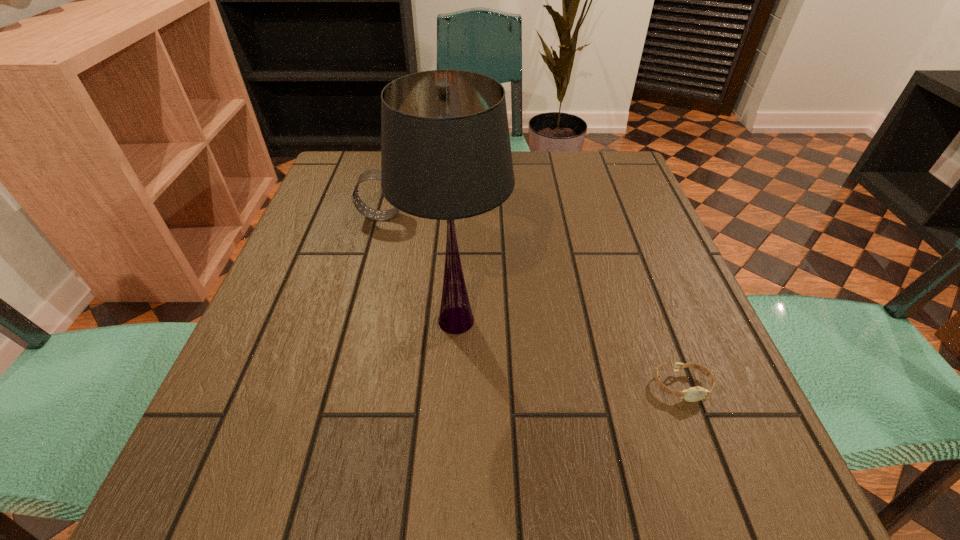
Where is `the second farthest object`? Image resolution: width=960 pixels, height=540 pixels. the second farthest object is located at coordinates point(445,146).

The width and height of the screenshot is (960, 540). I want to click on the tallest object, so click(445, 146).

Find the location of `the farthest object`. the farthest object is located at coordinates (375, 174).

Find the location of a particular element. Image resolution: width=960 pixels, height=540 pixels. the leftmost object is located at coordinates click(x=375, y=174).

At what (x,y) coordinates should I click in order to perform the action: click on the right watch. Please return your answer as a coordinate pair (x, y). Image resolution: width=960 pixels, height=540 pixels. Looking at the image, I should click on (693, 394).

Where is `the nearer watch`? Image resolution: width=960 pixels, height=540 pixels. the nearer watch is located at coordinates (693, 394).

Where is `free location located on the front-facing side of the tallest object`? This screenshot has height=540, width=960. free location located on the front-facing side of the tallest object is located at coordinates [539, 321].

Find the location of a particular element. Image resolution: width=960 pixels, height=540 pixels. vacant space positioned on the face of the leftmost object is located at coordinates (531, 216).

Find the location of a particular element. vacant area located on the face of the shortest object is located at coordinates (719, 487).

Identify the location of object at the left edge. This screenshot has width=960, height=540. (375, 174).